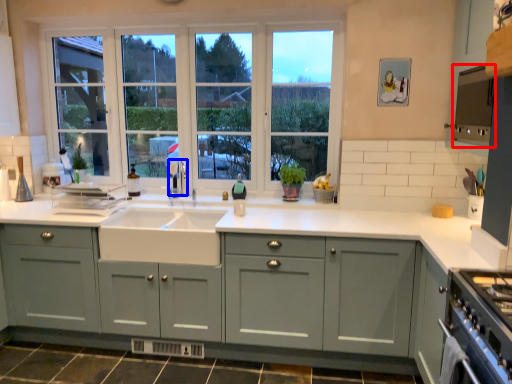
Question: Which point is closer to the camera, appliance (highlighted by a red box) or faucet (highlighted by a blue box)?

Choices:
 (A) appliance
 (B) faucet

Answer: (A)